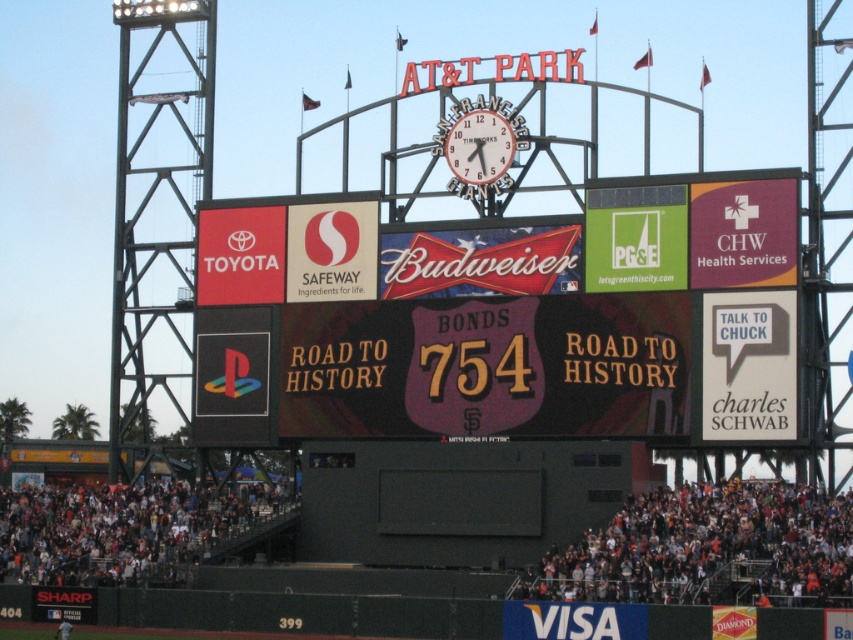
Question: Does black matte scoreboard at center have a smaller size compared to white metallic clock at center?

Choices:
 (A) no
 (B) yes

Answer: (A)

Question: Among these points, which one is farthest from the camera?

Choices:
 (A) (485, 168)
 (B) (257, 300)

Answer: (B)

Question: Considering the relative positions of black matte scoreboard at center and white metallic clock at center in the image provided, where is black matte scoreboard at center located with respect to white metallic clock at center?

Choices:
 (A) left
 (B) right

Answer: (A)

Question: Does black matte scoreboard at center appear on the left side of white metallic clock at center?

Choices:
 (A) no
 (B) yes

Answer: (B)

Question: Which object appears farthest from the camera in this image?

Choices:
 (A) black matte scoreboard at center
 (B) white metallic clock at center

Answer: (B)

Question: Which of the following is the farthest from the observer?

Choices:
 (A) white metallic clock at center
 (B) black matte scoreboard at center

Answer: (A)